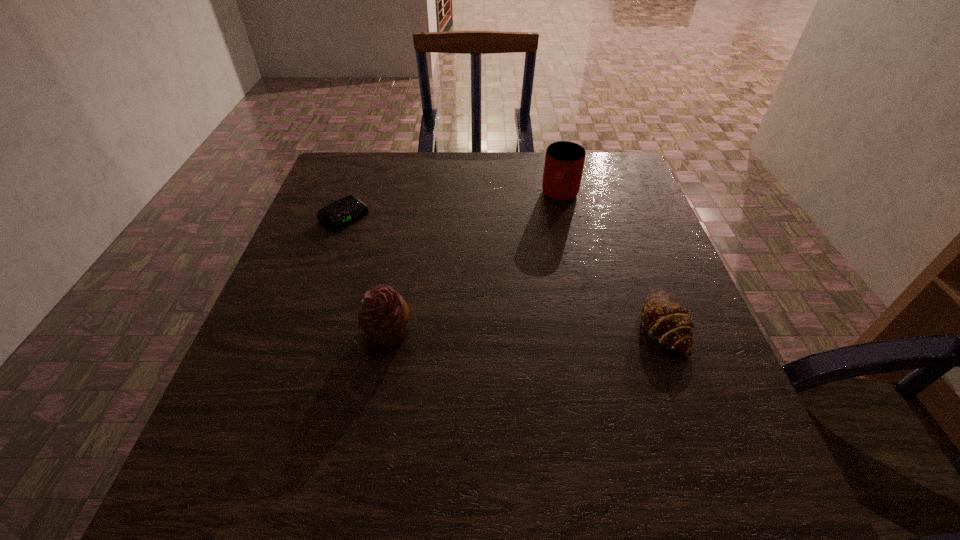
At what (x,y) coordinates should I click in order to perform the action: click on blank space located 0.250m on the handle side of the second object from right to left. Please return your answer as a coordinate pair (x, y). The height and width of the screenshot is (540, 960). Looking at the image, I should click on (536, 274).

The height and width of the screenshot is (540, 960). Find the location of `free space located on the display of the shortest object`. free space located on the display of the shortest object is located at coordinates (461, 302).

Image resolution: width=960 pixels, height=540 pixels. I want to click on free space located on the display of the shortest object, so click(420, 272).

This screenshot has width=960, height=540. What are the coordinates of `vacant space located 0.080m on the display of the shortest object` in the screenshot? It's located at (377, 241).

The image size is (960, 540). What are the coordinates of `object that is positioned at the far edge` in the screenshot? It's located at click(564, 161).

At what (x,y) coordinates should I click in order to perform the action: click on object positioned at the left edge. Please return your answer as a coordinate pair (x, y). Image resolution: width=960 pixels, height=540 pixels. Looking at the image, I should click on (349, 208).

I want to click on object located in the right edge section of the desktop, so click(x=666, y=321).

The image size is (960, 540). I want to click on vacant space at the far edge, so click(x=404, y=180).

Identify the location of vacant space at the near edge. The width and height of the screenshot is (960, 540). (484, 434).

In the image, there is a desktop. At what (x,y) coordinates should I click in order to perform the action: click on vacant space at the left edge. Please return your answer as a coordinate pair (x, y). The image size is (960, 540). Looking at the image, I should click on (317, 212).